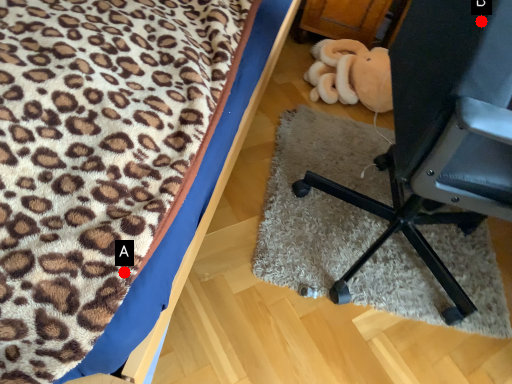
Question: Two points are circled on the image, labeled by A and B beside each circle. Which point is farther from the camera taking this photo?

Choices:
 (A) A is further
 (B) B is further

Answer: (B)